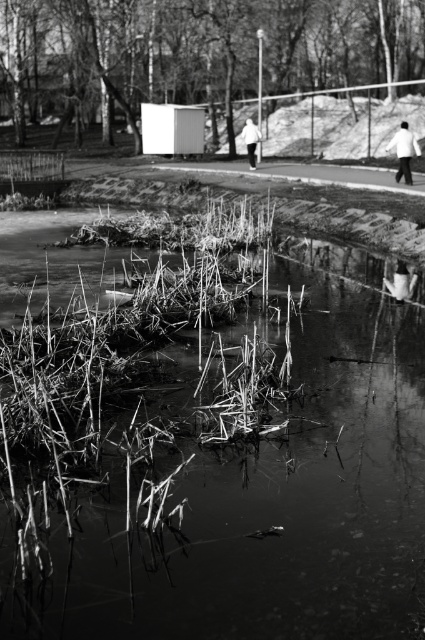
Between point (246, 449) and point (254, 150), which one is positioned in front?

Positioned in front is point (246, 449).

Where is `reeds at lower center`? This screenshot has width=425, height=640. reeds at lower center is located at coordinates (268, 506).

I want to click on reeds at lower center, so click(x=268, y=506).

Does white matte jacket at upper right have a larger size compared to white fabric shoe at lower right?

Yes.

What do you see at coordinates (404, 150) in the screenshot? I see `white matte jacket at upper right` at bounding box center [404, 150].

Locate an element on the screen. This screenshot has width=425, height=640. white matte jacket at upper right is located at coordinates (404, 150).

Does point (404, 172) lie in front of point (257, 129)?

That is True.

Describe the element at coordinates (404, 150) in the screenshot. This screenshot has width=425, height=640. I see `white matte jacket at upper right` at that location.

The width and height of the screenshot is (425, 640). I want to click on white matte jacket at upper right, so click(x=404, y=150).